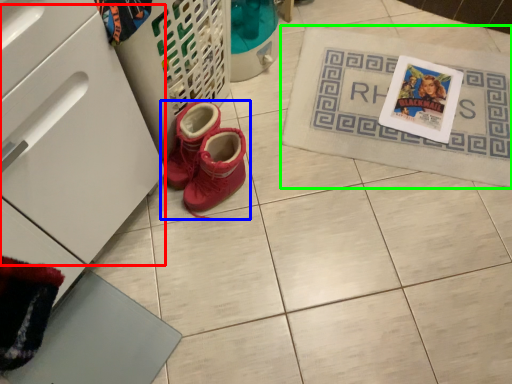
Question: Considering the real-world distances, which object is closest to drawer (highlighted by a red box)? footwear (highlighted by a blue box) or bath mat (highlighted by a green box).

Choices:
 (A) footwear
 (B) bath mat

Answer: (A)